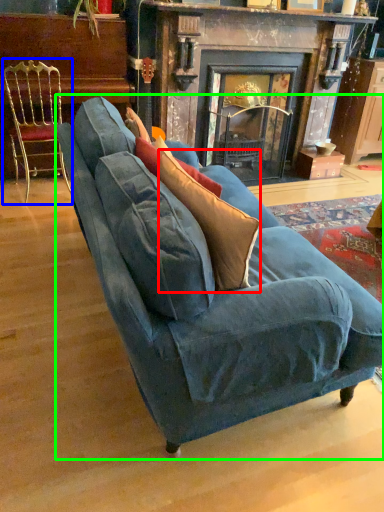
Question: Which object is positioned farthest from throw pillow (highlighted by a red box)? Select from chair (highlighted by a blue box) and studio couch (highlighted by a green box).

Choices:
 (A) chair
 (B) studio couch

Answer: (A)